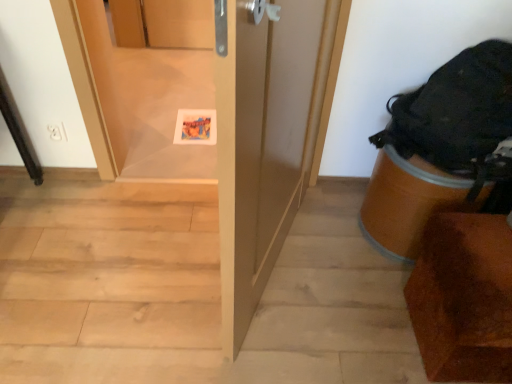
This screenshot has width=512, height=384. I want to click on vacant region above matte paper postcard at center (from a real-world perspective), so click(x=192, y=117).